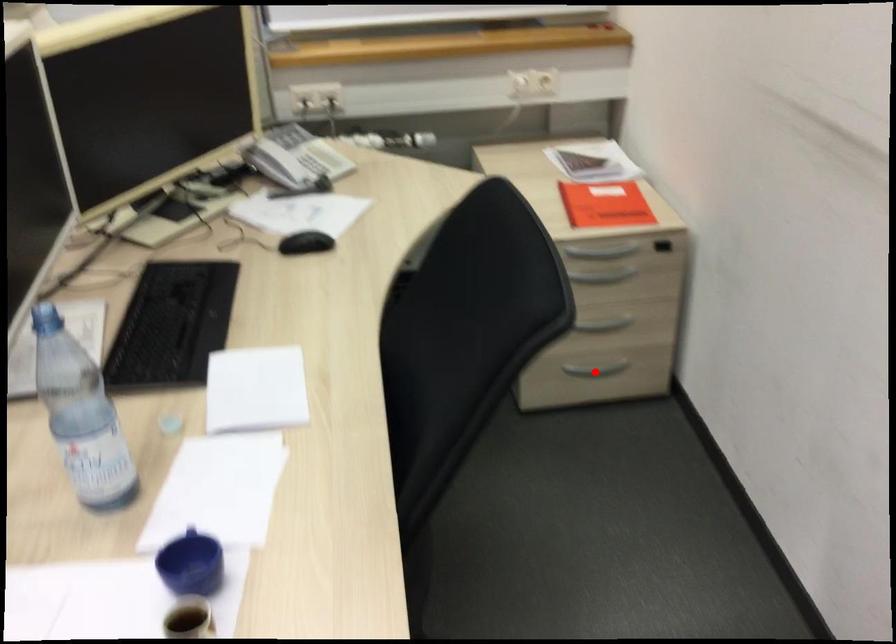
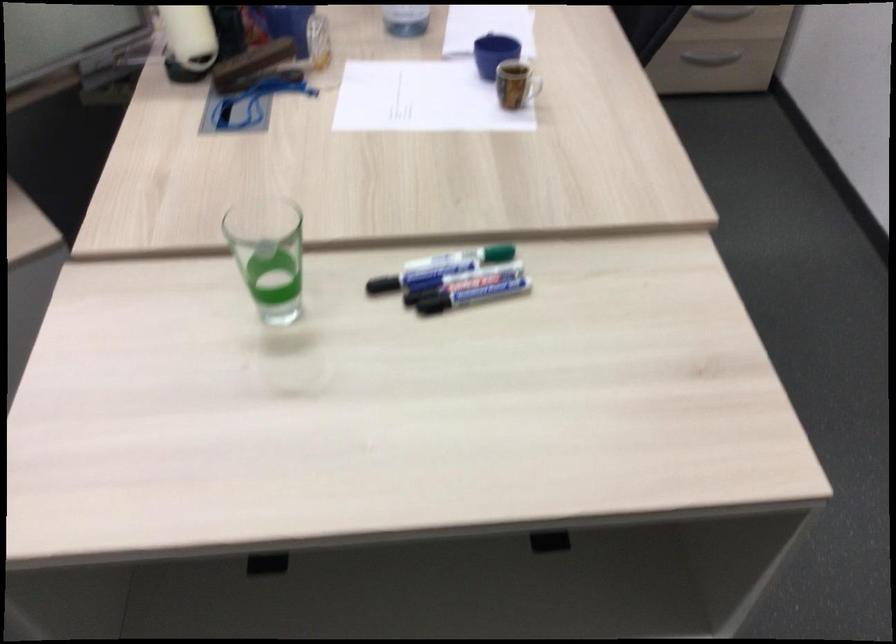
Question: A red point is marked in image1. In image2, is the corresponding 3D point closer to the camera or farther? Reply with the corresponding letter.

Choices:
 (A) The corresponding 3D point is closer.
 (B) The corresponding 3D point is farther.

Answer: (B)